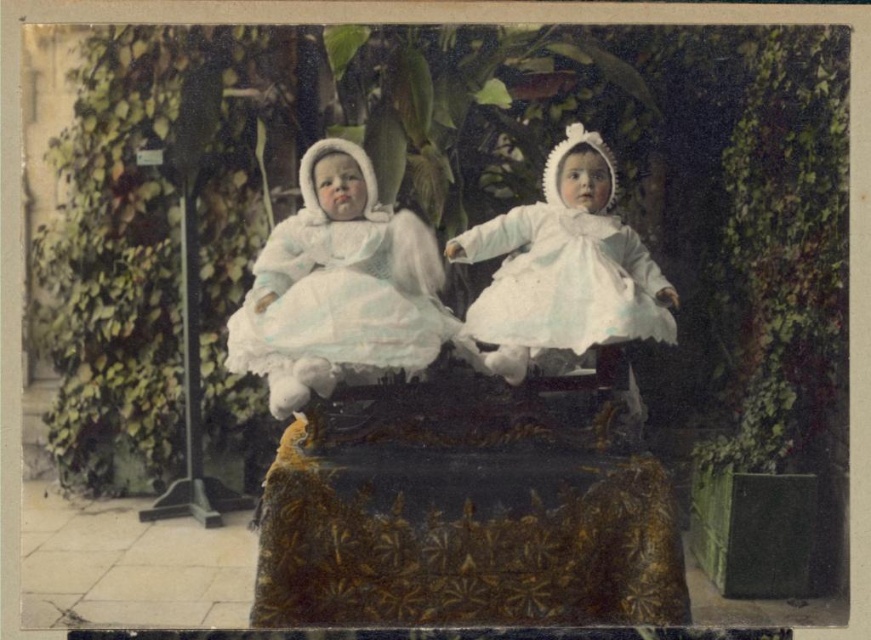
Question: Which of the following is the closest to the observer?

Choices:
 (A) white lace dress at center
 (B) white satin dress at center

Answer: (A)

Question: Which point appears farthest from the camera in this image?

Choices:
 (A) (532, 214)
 (B) (315, 291)

Answer: (A)

Question: Is white satin dress at center closer to the viewer compared to white lace dress at center?

Choices:
 (A) no
 (B) yes

Answer: (A)

Question: Can you confirm if white satin dress at center is wider than white lace dress at center?

Choices:
 (A) yes
 (B) no

Answer: (B)

Question: Is the position of white satin dress at center less distant than that of white lace dress at center?

Choices:
 (A) yes
 (B) no

Answer: (B)